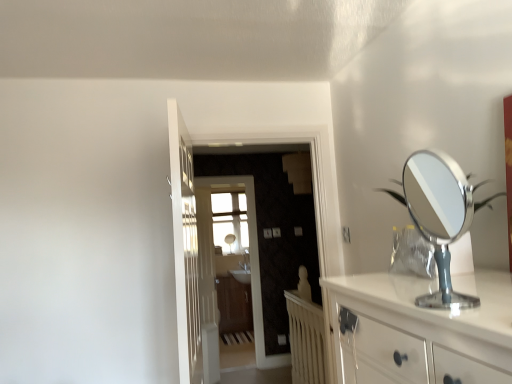
Question: Can you confirm if wooden cabinet at center is bigger than white wooden radiator at center?

Choices:
 (A) no
 (B) yes

Answer: (B)

Question: Considering the relative sizes of wooden cabinet at center and white wooden radiator at center in the image provided, is wooden cabinet at center thinner than white wooden radiator at center?

Choices:
 (A) no
 (B) yes

Answer: (A)

Question: Is wooden cabinet at center at the right side of white wooden radiator at center?

Choices:
 (A) yes
 (B) no

Answer: (B)

Question: Does wooden cabinet at center appear on the left side of white wooden radiator at center?

Choices:
 (A) no
 (B) yes

Answer: (B)

Question: Is wooden cabinet at center positioned with its back to white wooden radiator at center?

Choices:
 (A) no
 (B) yes

Answer: (A)

Question: Relative to clear glass door at center, the second screen door positioned from the front, is white wooden door at center, which is counted as the first door, starting from the back, in front or behind?

Choices:
 (A) front
 (B) behind

Answer: (B)

Question: Does point (218, 372) appear closer or farther from the camera than point (245, 188)?

Choices:
 (A) farther
 (B) closer

Answer: (B)

Question: From the image's perspective, relative to clear glass door at center, the 1th screen door from the back, is white wooden door at center, the second door in the front-to-back sequence, above or below?

Choices:
 (A) below
 (B) above

Answer: (A)

Question: Looking at the image, does white wooden door at center, which is counted as the first door, starting from the back, seem bigger or smaller compared to clear glass door at center, the 1th screen door from the back?

Choices:
 (A) small
 (B) big

Answer: (A)

Question: From their relative heights in the image, would you say white wooden door at center, arranged as the 2th door when viewed from the right, is taller or shorter than wooden cabinet at center?

Choices:
 (A) short
 (B) tall

Answer: (B)

Question: Is white wooden door at center, the second door in the front-to-back sequence, situated inside wooden cabinet at center or outside?

Choices:
 (A) outside
 (B) inside

Answer: (A)

Question: From the image's perspective, is white wooden door at center, arranged as the 2th door when viewed from the right, positioned above or below wooden cabinet at center?

Choices:
 (A) above
 (B) below

Answer: (A)

Question: In terms of size, does white wooden door at center, the second door in the front-to-back sequence, appear bigger or smaller than wooden cabinet at center?

Choices:
 (A) small
 (B) big

Answer: (A)

Question: Considering the positions of white glossy door at center, placed as the first door when sorted from front to back, and matte wood screen door at center, the first screen door in the front-to-back sequence, in the image, is white glossy door at center, placed as the first door when sorted from front to back, wider or thinner than matte wood screen door at center, the first screen door in the front-to-back sequence,?

Choices:
 (A) thin
 (B) wide

Answer: (B)

Question: Is white glossy door at center, placed as the first door when sorted from front to back, to the left or to the right of matte wood screen door at center, the first screen door in the front-to-back sequence, in the image?

Choices:
 (A) right
 (B) left

Answer: (B)